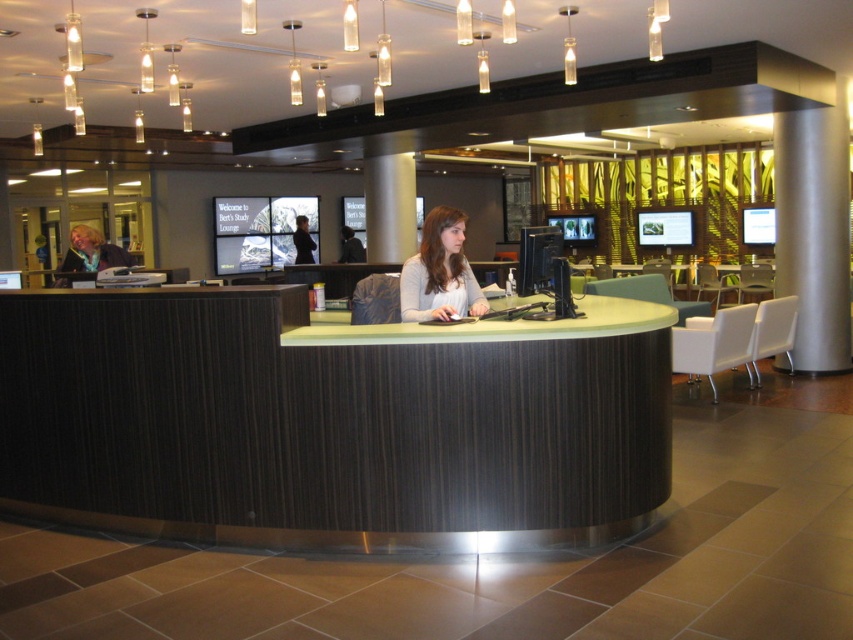
Is point (445, 232) positioned behind point (102, 257)?

No, it is in front of (102, 257).

Between light gray sweater at center and matte black jacket at left, which one appears on the left side from the viewer's perspective?

matte black jacket at left

Does point (418, 294) lie in front of point (93, 236)?

Yes, it is in front of point (93, 236).

Locate an element on the screen. This screenshot has height=640, width=853. light gray sweater at center is located at coordinates (440, 273).

In the scene shown: Can you confirm if dark wood/striped pattern information desk at center is thinner than matte black jacket at left?

In fact, dark wood/striped pattern information desk at center might be wider than matte black jacket at left.

This screenshot has height=640, width=853. Describe the element at coordinates (331, 420) in the screenshot. I see `dark wood/striped pattern information desk at center` at that location.

Is point (640, 472) farther from viewer compared to point (73, 232)?

No, (640, 472) is closer to viewer.

Where is `dark wood/striped pattern information desk at center`? The height and width of the screenshot is (640, 853). dark wood/striped pattern information desk at center is located at coordinates (331, 420).

Is dark wood/striped pattern information desk at center to the left of light gray sweater at center from the viewer's perspective?

Correct, you'll find dark wood/striped pattern information desk at center to the left of light gray sweater at center.

Which is more to the right, dark wood/striped pattern information desk at center or light gray sweater at center?

light gray sweater at center is more to the right.

Who is more distant from viewer, (498, 470) or (412, 278)?

Point (412, 278)

Locate an element on the screen. The image size is (853, 640). dark wood/striped pattern information desk at center is located at coordinates (331, 420).